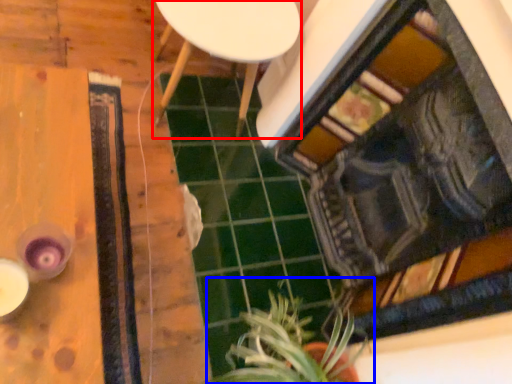
Question: Which object is further to the camera taking this photo, furniture (highlighted by a red box) or houseplant (highlighted by a blue box)?

Choices:
 (A) furniture
 (B) houseplant

Answer: (A)